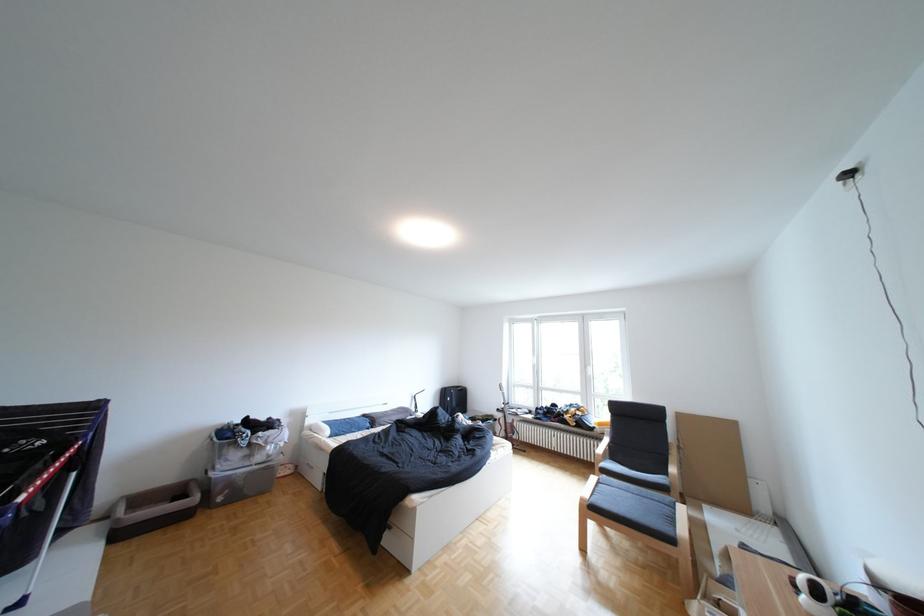
What do you see at coordinates (507, 421) in the screenshot? I see `the acoustic guitar` at bounding box center [507, 421].